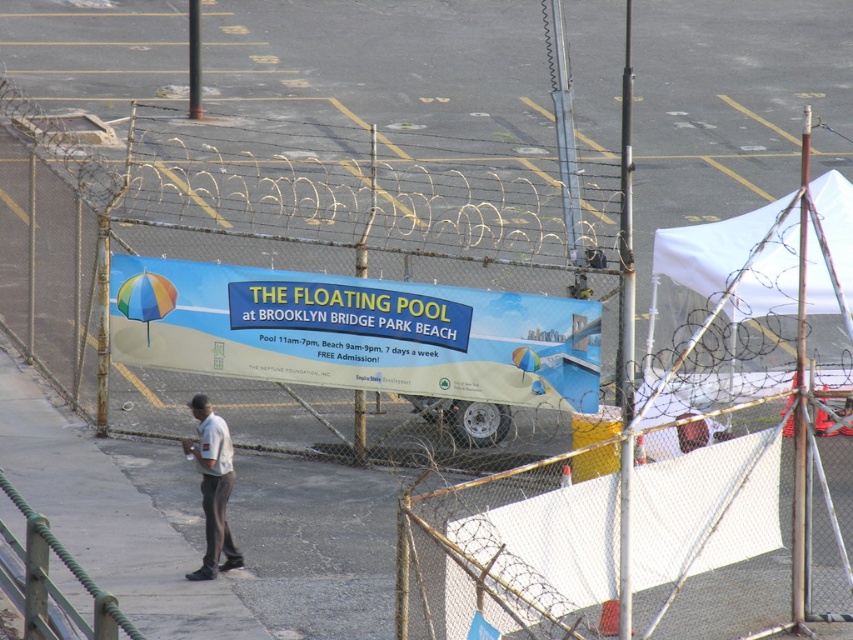
You are a delivery person needing to place a package on the white fabric canopy at upper right. You are currently standing at the white cotton shirt at center. Can you reach the canopy without moving closer? Please explain your reasoning.

The distance between the white fabric canopy at upper right and the white cotton shirt at center is 16.12 feet. Since the average person can reach about 6 feet without moving, you would need to move closer to place the package.